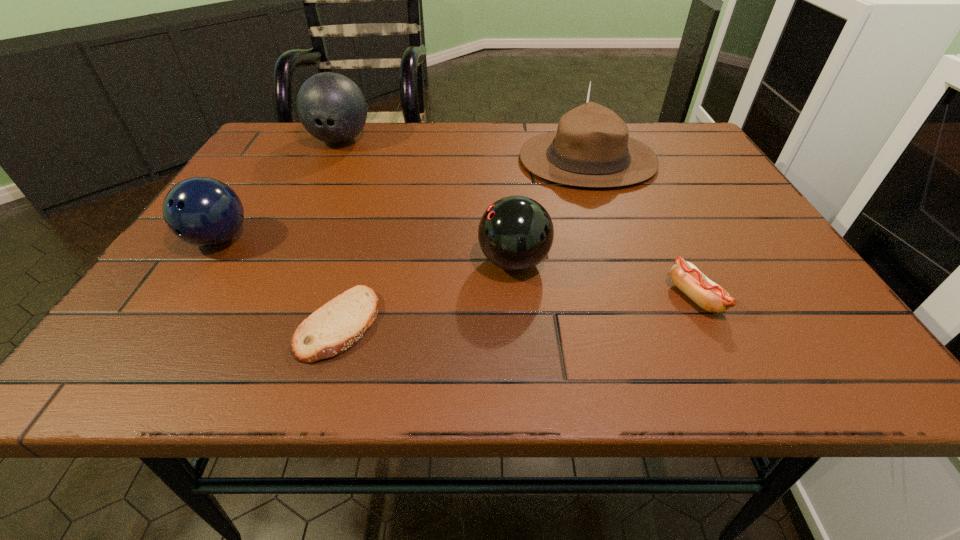
Where is `vacant space located on the surface of the rightmost bowling ball near the finger holes`? This screenshot has height=540, width=960. vacant space located on the surface of the rightmost bowling ball near the finger holes is located at coordinates coord(431,262).

Locate an element on the screen. The height and width of the screenshot is (540, 960). blank space located on the surface of the rightmost bowling ball near the finger holes is located at coordinates (280, 262).

This screenshot has width=960, height=540. In order to click on vacant space located on the back of the sausage in this screenshot , I will do (669, 244).

The width and height of the screenshot is (960, 540). What are the coordinates of `vacant space situated 0.220m on the back of the pita bread` in the screenshot? It's located at (371, 217).

Locate an element on the screen. This screenshot has width=960, height=540. bowling ball positioned at the far edge is located at coordinates (331, 107).

The image size is (960, 540). Identify the location of fedora at the far edge. (591, 148).

Find the location of a particular element. The width and height of the screenshot is (960, 540). object located at the near edge is located at coordinates (337, 325).

Locate an element on the screen. The width and height of the screenshot is (960, 540). object that is positioned at the right edge is located at coordinates (591, 148).

At what (x,y) coordinates should I click in order to perform the action: click on object located at the far left corner. Please return your answer as a coordinate pair (x, y). The width and height of the screenshot is (960, 540). Looking at the image, I should click on (331, 107).

This screenshot has width=960, height=540. In order to click on object at the far right corner in this screenshot , I will do `click(591, 148)`.